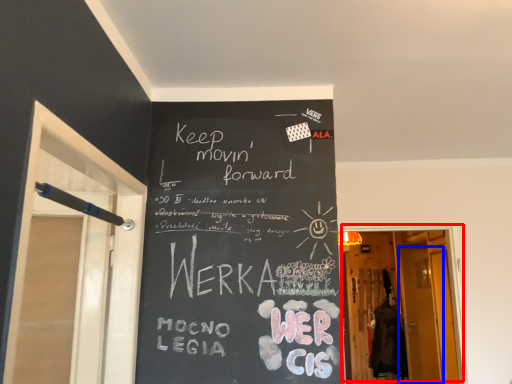
Question: Which of the following is the farthest to the observer, door (highlighted by a red box) or screen door (highlighted by a blue box)?

Choices:
 (A) door
 (B) screen door

Answer: (B)